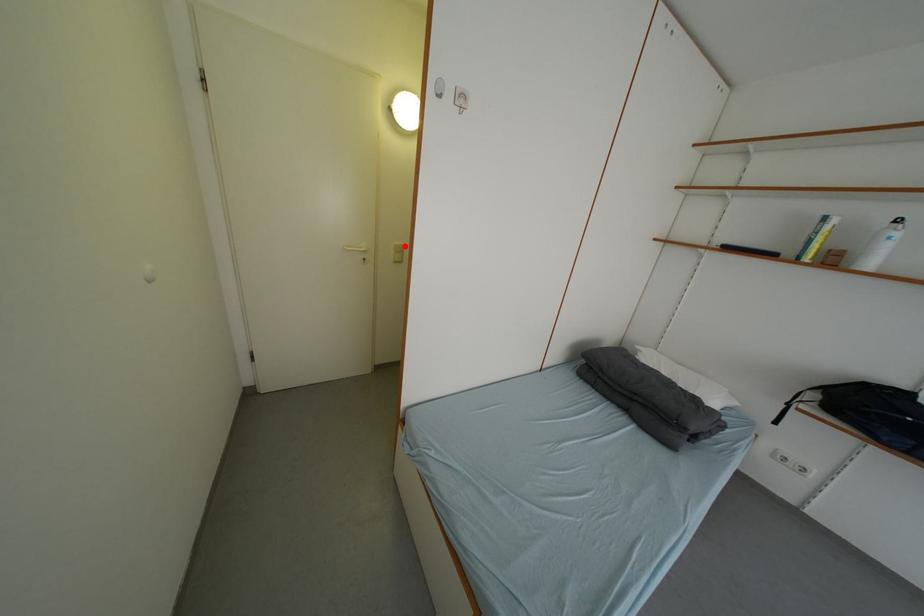
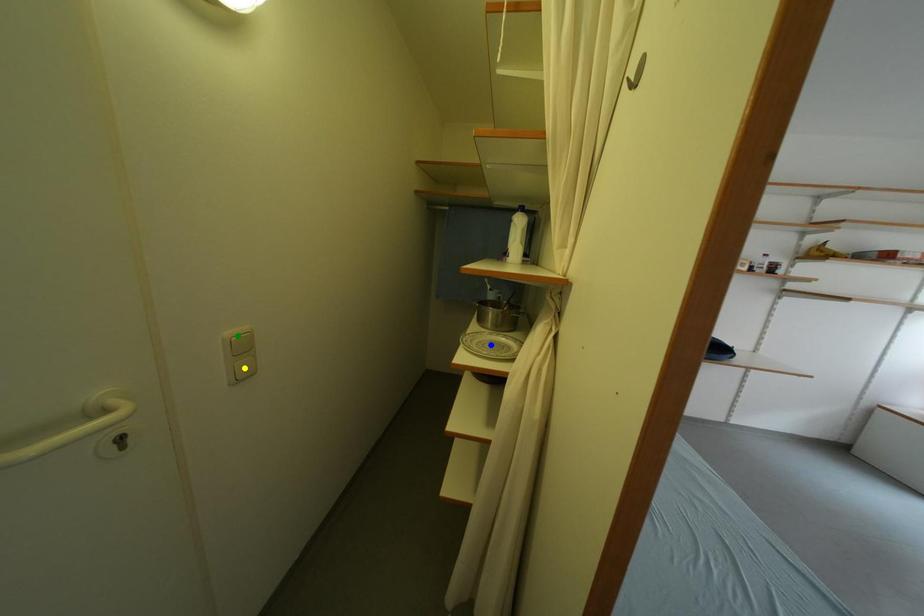
Question: I am providing you with two images of the same scene from different viewpoints. A red point is marked on the first image. You are given multiple points on the second image. Which point in image 2 represents the same 3d spot as the red point in image 1?

Choices:
 (A) green point
 (B) blue point
 (C) yellow point

Answer: (A)